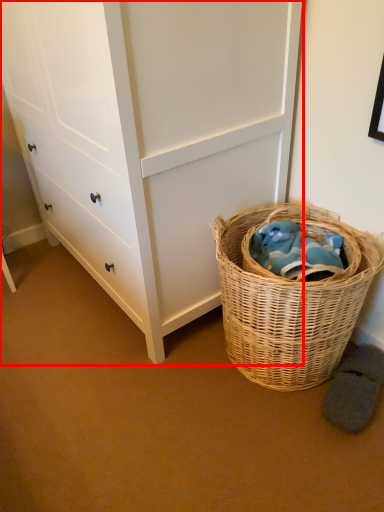
Question: From the image's perspective, considering the relative positions of chest of drawers (annotated by the red box) and picnic basket in the image provided, where is chest of drawers (annotated by the red box) located with respect to the staircase?

Choices:
 (A) above
 (B) below

Answer: (A)